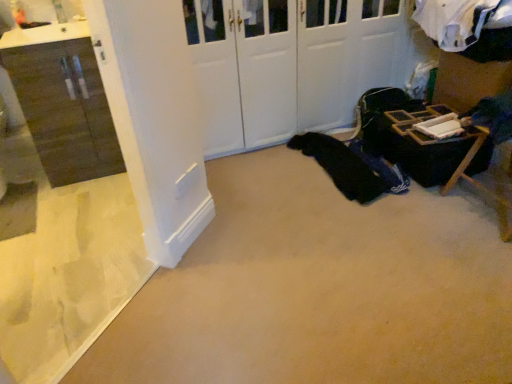
The image size is (512, 384). Identify the location of vacant space situated on the left part of black fabric at center. (268, 173).